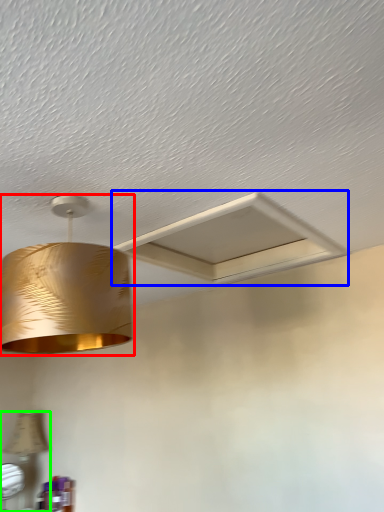
Question: Which is farther away from lamp (highlighted by a red box)? exhaust hood (highlighted by a blue box) or lamp (highlighted by a green box)?

Choices:
 (A) exhaust hood
 (B) lamp

Answer: (B)